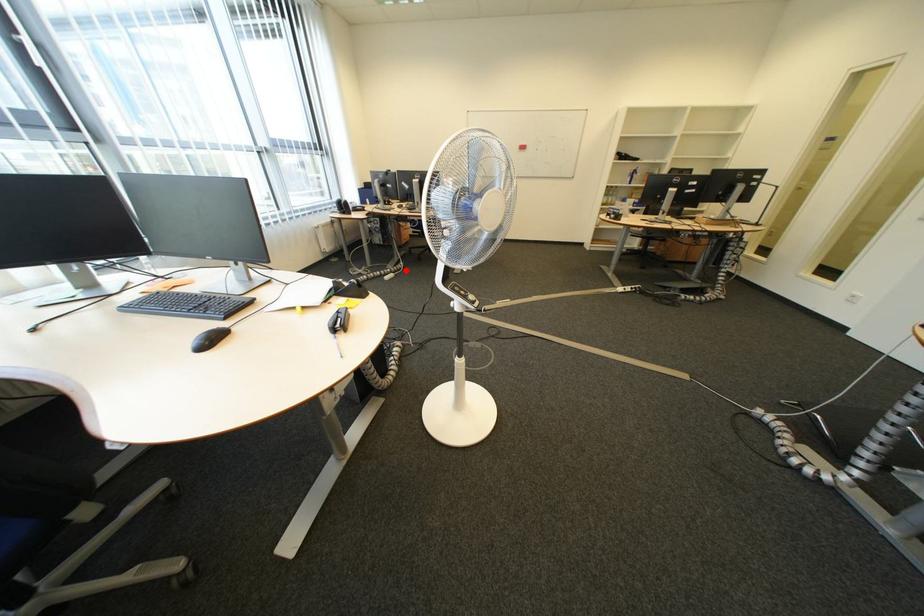
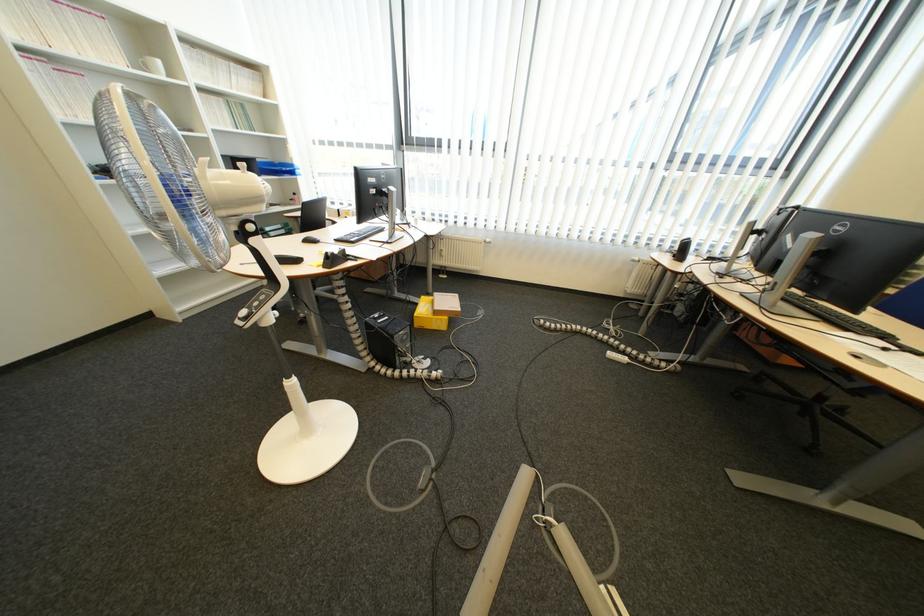
Question: I am providing you with two images of the same scene from different viewpoints. Given a red point in image1, look at the same physical point in image2. Is it:

Choices:
 (A) Closer to the viewpoint
 (B) Farther from the viewpoint

Answer: (B)